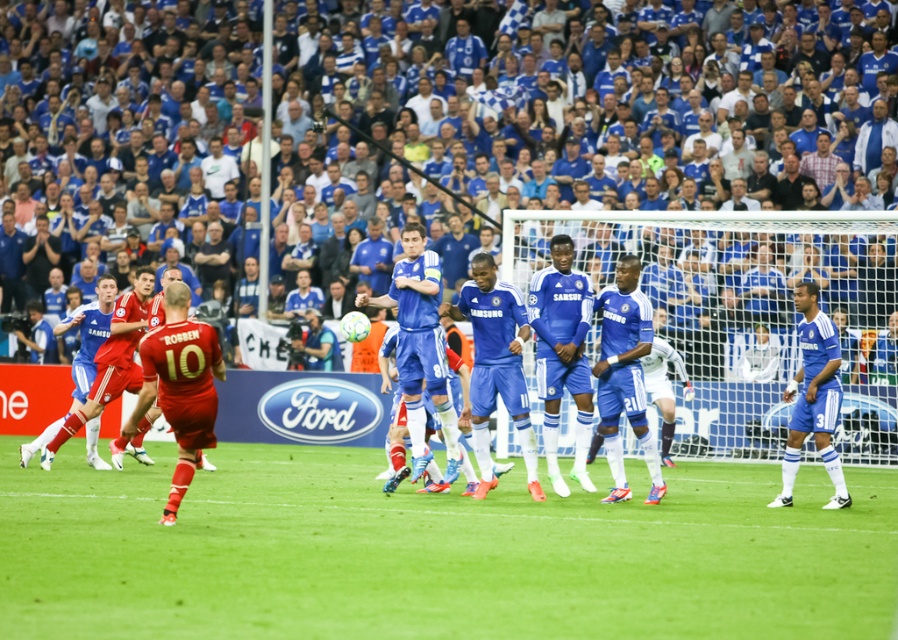
Is point (223, 632) closer to camera compared to point (557, 337)?

Yes, point (223, 632) is closer to viewer.

Who is positioned more to the left, green grass at center or blue jersey crowd at upper center?

blue jersey crowd at upper center

Is point (850, 557) positioned after point (800, 256)?

No, (850, 557) is in front of (800, 256).

At what (x,y) coordinates should I click in order to perform the action: click on green grass at center. Please return your answer as a coordinate pair (x, y). This screenshot has width=898, height=640. Looking at the image, I should click on (434, 552).

Which is in front, point (835, 305) or point (834, 374)?

Point (834, 374) is in front.

Looking at this image, is blue jersey crowd at upper center bigger than blue matte jersey at right?

Yes, blue jersey crowd at upper center is bigger than blue matte jersey at right.

I want to click on blue jersey crowd at upper center, so click(755, 291).

Locate an element on the screen. The width and height of the screenshot is (898, 640). blue jersey crowd at upper center is located at coordinates (755, 291).

Which of these two, green grass at center or blue matte soccer players at center, stands shorter?

With less height is green grass at center.

Describe the element at coordinates (434, 552) in the screenshot. I see `green grass at center` at that location.

The width and height of the screenshot is (898, 640). Find the location of `green grass at center`. green grass at center is located at coordinates (434, 552).